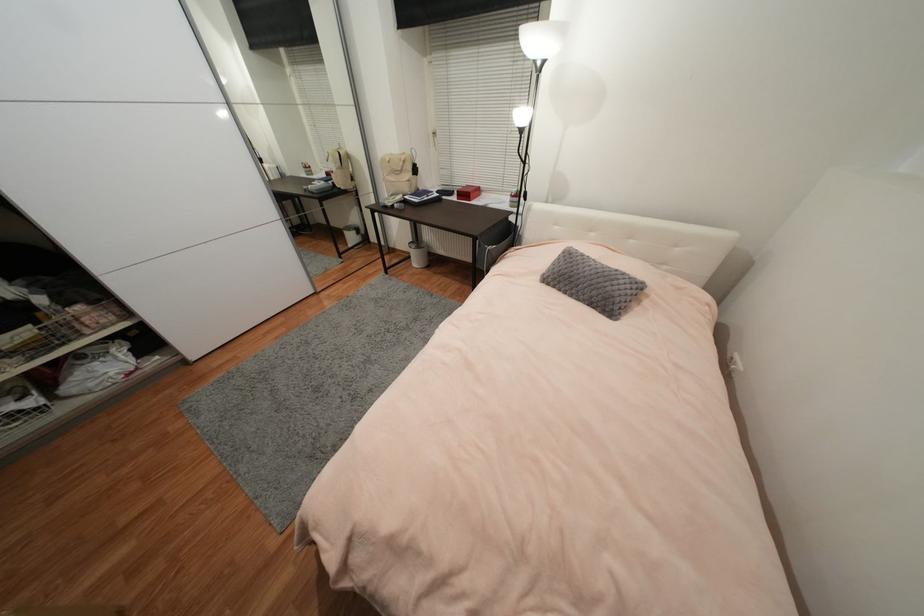
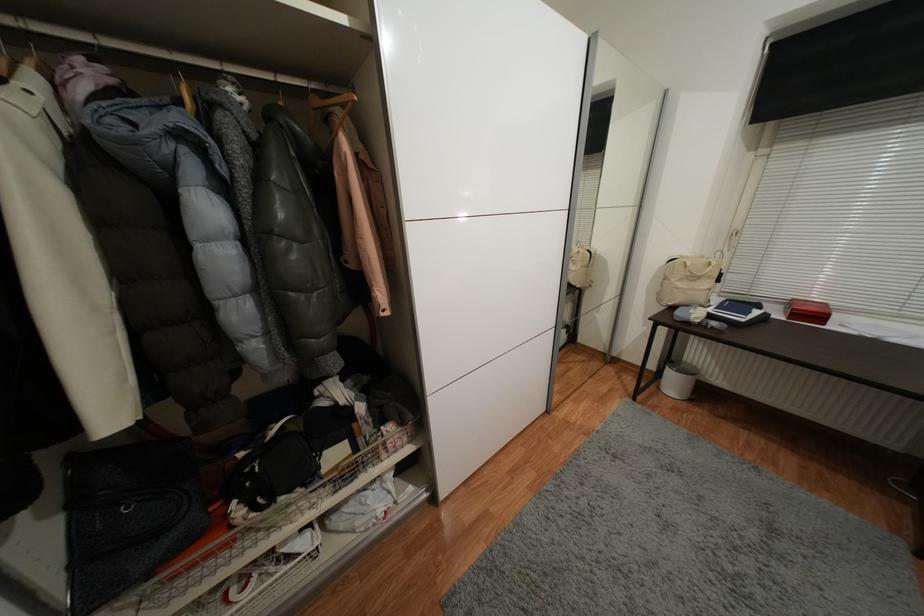
Find the pixel in the second image that matches (x=33, y=361) in the first image.

(342, 493)